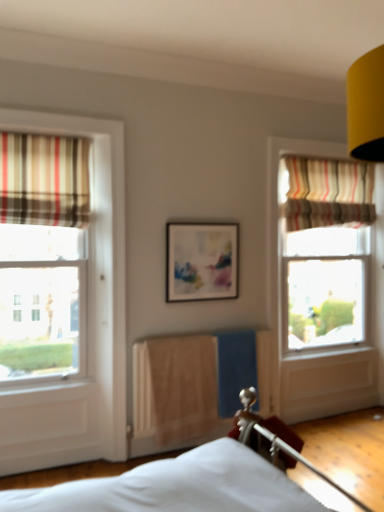
Locate an element on the screen. This screenshot has width=384, height=512. beige fabric radiator at center is located at coordinates (176, 389).

The image size is (384, 512). What are the coordinates of `striped fabric curtain at left, positioned as the first curtain in left-to-right order` in the screenshot? It's located at (44, 180).

Describe the element at coordinates (327, 193) in the screenshot. I see `striped fabric curtain at upper right, acting as the first curtain starting from the right` at that location.

Find the location of a particular element. matte plastic picture frame at center is located at coordinates (202, 261).

Considering the sizes of striped fabric curtain at upper right, which ranks as the 2th curtain in front-to-back order, and striped fabric curtain at left, the 2th curtain positioned from the back, in the image, is striped fabric curtain at upper right, which ranks as the 2th curtain in front-to-back order, wider or thinner than striped fabric curtain at left, the 2th curtain positioned from the back,?

In the image, striped fabric curtain at upper right, which ranks as the 2th curtain in front-to-back order, appears to be wider than striped fabric curtain at left, the 2th curtain positioned from the back.

How different are the orientations of striped fabric curtain at upper right, which is the second curtain in left-to-right order, and striped fabric curtain at left, positioned as the first curtain in left-to-right order, in degrees?

1.07 degrees separate the facing orientations of striped fabric curtain at upper right, which is the second curtain in left-to-right order, and striped fabric curtain at left, positioned as the first curtain in left-to-right order.

Is striped fabric curtain at left, the 2th curtain positioned from the back, at the back of striped fabric curtain at upper right, which is the second curtain in left-to-right order?

striped fabric curtain at upper right, which is the second curtain in left-to-right order, does not have its back to striped fabric curtain at left, the 2th curtain positioned from the back.

Considering the positions of objects striped fabric curtain at upper right, which ranks as the 2th curtain in front-to-back order, and striped fabric curtain at left, positioned as the first curtain in left-to-right order, in the image provided, who is more to the right, striped fabric curtain at upper right, which ranks as the 2th curtain in front-to-back order, or striped fabric curtain at left, positioned as the first curtain in left-to-right order,?

From the viewer's perspective, striped fabric curtain at upper right, which ranks as the 2th curtain in front-to-back order, appears more on the right side.

What's the angular difference between striped fabric curtain at upper right, which ranks as the 2th curtain in front-to-back order, and matte plastic picture frame at center's facing directions?

They differ by 0.911 degrees in their facing directions.

Do you think striped fabric curtain at upper right, which is the second curtain in left-to-right order, is within matte plastic picture frame at center, or outside of it?

striped fabric curtain at upper right, which is the second curtain in left-to-right order, exists outside the volume of matte plastic picture frame at center.

Is striped fabric curtain at upper right, which appears as the 1th curtain when viewed from the back, oriented away from matte plastic picture frame at center?

No, striped fabric curtain at upper right, which appears as the 1th curtain when viewed from the back,'s orientation is not away from matte plastic picture frame at center.

Locate an element on the screen. The image size is (384, 512). picture frame that is under the striped fabric curtain at upper right, which ranks as the 2th curtain in front-to-back order (from a real-world perspective) is located at coordinates (202, 261).

Is striped fabric curtain at upper right, acting as the first curtain starting from the right, completely or partially inside matte plastic picture frame at center?

No.

Is matte plastic picture frame at center wider or thinner than striped fabric curtain at upper right, which is the second curtain in left-to-right order?

Clearly, matte plastic picture frame at center has less width compared to striped fabric curtain at upper right, which is the second curtain in left-to-right order.

From the picture: Who is shorter, matte plastic picture frame at center or striped fabric curtain at upper right, which is the second curtain in left-to-right order?

matte plastic picture frame at center.

Can you confirm if matte plastic picture frame at center is positioned to the left of beige fabric radiator at center?

Yes, matte plastic picture frame at center is to the left of beige fabric radiator at center.

Between matte plastic picture frame at center and beige fabric radiator at center, which one has larger width?

beige fabric radiator at center is wider.

Considering the sizes of objects matte plastic picture frame at center and beige fabric radiator at center in the image provided, who is bigger, matte plastic picture frame at center or beige fabric radiator at center?

beige fabric radiator at center is bigger.

Can you confirm if matte plastic picture frame at center is taller than beige fabric radiator at center?

No.

Does striped fabric curtain at left, positioned as the first curtain in left-to-right order, lie in front of striped fabric curtain at upper right, acting as the first curtain starting from the right?

Yes, striped fabric curtain at left, positioned as the first curtain in left-to-right order, is closer to the viewer.

Considering the sizes of striped fabric curtain at left, positioned as the first curtain in left-to-right order, and striped fabric curtain at upper right, which is the second curtain in left-to-right order, in the image, is striped fabric curtain at left, positioned as the first curtain in left-to-right order, bigger or smaller than striped fabric curtain at upper right, which is the second curtain in left-to-right order,?

striped fabric curtain at left, positioned as the first curtain in left-to-right order, is smaller than striped fabric curtain at upper right, which is the second curtain in left-to-right order.

Is striped fabric curtain at left, the 2th curtain positioned from the back, oriented away from striped fabric curtain at upper right, acting as the first curtain starting from the right?

striped fabric curtain at left, the 2th curtain positioned from the back, is not turned away from striped fabric curtain at upper right, acting as the first curtain starting from the right.

From the image's perspective, does striped fabric curtain at left, positioned as the first curtain in left-to-right order, appear lower than striped fabric curtain at upper right, acting as the first curtain starting from the right?

Correct, striped fabric curtain at left, positioned as the first curtain in left-to-right order, appears lower than striped fabric curtain at upper right, acting as the first curtain starting from the right, in the image.

Looking at this image, between matte plastic picture frame at center and striped fabric curtain at left, which is the 2th curtain in right-to-left order, which one has larger size?

striped fabric curtain at left, which is the 2th curtain in right-to-left order, is bigger.

Looking at this image, is matte plastic picture frame at center oriented towards striped fabric curtain at left, positioned as the first curtain in left-to-right order?

No, matte plastic picture frame at center is not facing towards striped fabric curtain at left, positioned as the first curtain in left-to-right order.

From a real-world perspective, is matte plastic picture frame at center physically above striped fabric curtain at left, the 1th curtain in the front-to-back sequence?

No, from a real-world perspective, matte plastic picture frame at center is not over striped fabric curtain at left, the 1th curtain in the front-to-back sequence

Does point (185, 279) come farther from viewer compared to point (3, 141)?

Yes, it is behind point (3, 141).

Is striped fabric curtain at left, which is the 2th curtain in right-to-left order, inside beige fabric radiator at center?

No, striped fabric curtain at left, which is the 2th curtain in right-to-left order, is located outside of beige fabric radiator at center.

From a real-world perspective, who is located lower, beige fabric radiator at center or striped fabric curtain at left, the 2th curtain positioned from the back?

In real-world perspective, beige fabric radiator at center is lower.

Which of these two, beige fabric radiator at center or striped fabric curtain at left, positioned as the first curtain in left-to-right order, is wider?

striped fabric curtain at left, positioned as the first curtain in left-to-right order, is wider.

Identify the location of curtain located on the left of striped fabric curtain at upper right, which appears as the 1th curtain when viewed from the back. (44, 180).

In the image, there is a striped fabric curtain at upper right, acting as the first curtain starting from the right. Identify the location of picture frame below it (from the image's perspective). (202, 261).

Based on their spatial positions, is beige fabric radiator at center or striped fabric curtain at upper right, which is the second curtain in left-to-right order, closer to striped fabric curtain at left, which is the 2th curtain in right-to-left order?

The object closer to striped fabric curtain at left, which is the 2th curtain in right-to-left order, is beige fabric radiator at center.

Based on their spatial positions, is striped fabric curtain at upper right, which is the second curtain in left-to-right order, or matte plastic picture frame at center closer to beige fabric radiator at center?

matte plastic picture frame at center.

Which object lies nearer to the anchor point matte plastic picture frame at center, striped fabric curtain at left, which is the 2th curtain in right-to-left order, or striped fabric curtain at upper right, which is the second curtain in left-to-right order?

The object closer to matte plastic picture frame at center is striped fabric curtain at left, which is the 2th curtain in right-to-left order.

Which object lies nearer to the anchor point striped fabric curtain at upper right, which ranks as the 2th curtain in front-to-back order, beige fabric radiator at center or matte plastic picture frame at center?

matte plastic picture frame at center is positioned closer to the anchor striped fabric curtain at upper right, which ranks as the 2th curtain in front-to-back order.

From the picture: When comparing their distances from striped fabric curtain at upper right, acting as the first curtain starting from the right, does matte plastic picture frame at center or beige fabric radiator at center seem closer?

The object closer to striped fabric curtain at upper right, acting as the first curtain starting from the right, is matte plastic picture frame at center.

Looking at the image, which one is located closer to striped fabric curtain at upper right, which is the second curtain in left-to-right order, matte plastic picture frame at center or striped fabric curtain at left, the 2th curtain positioned from the back?

matte plastic picture frame at center lies closer to striped fabric curtain at upper right, which is the second curtain in left-to-right order, than the other object.

Which object lies further to the anchor point striped fabric curtain at upper right, which ranks as the 2th curtain in front-to-back order, beige fabric radiator at center or striped fabric curtain at left, the 1th curtain in the front-to-back sequence?

striped fabric curtain at left, the 1th curtain in the front-to-back sequence, lies further to striped fabric curtain at upper right, which ranks as the 2th curtain in front-to-back order, than the other object.

When comparing their distances from matte plastic picture frame at center, does beige fabric radiator at center or striped fabric curtain at left, the 2th curtain positioned from the back, seem closer?

beige fabric radiator at center is closer to matte plastic picture frame at center.

Locate an element on the screen. picture frame between striped fabric curtain at upper right, acting as the first curtain starting from the right, and beige fabric radiator at center, in the vertical direction is located at coordinates (202, 261).

Locate an element on the screen. This screenshot has height=512, width=384. picture frame located between striped fabric curtain at left, the 1th curtain in the front-to-back sequence, and striped fabric curtain at upper right, which ranks as the 2th curtain in front-to-back order, in the left-right direction is located at coordinates (202, 261).

Where is `radiator between striped fabric curtain at left, the 1th curtain in the front-to-back sequence, and striped fabric curtain at upper right, which ranks as the 2th curtain in front-to-back order, from left to right`? Image resolution: width=384 pixels, height=512 pixels. radiator between striped fabric curtain at left, the 1th curtain in the front-to-back sequence, and striped fabric curtain at upper right, which ranks as the 2th curtain in front-to-back order, from left to right is located at coordinates (176, 389).

The image size is (384, 512). I want to click on picture frame that lies between striped fabric curtain at left, the 2th curtain positioned from the back, and beige fabric radiator at center from top to bottom, so click(202, 261).